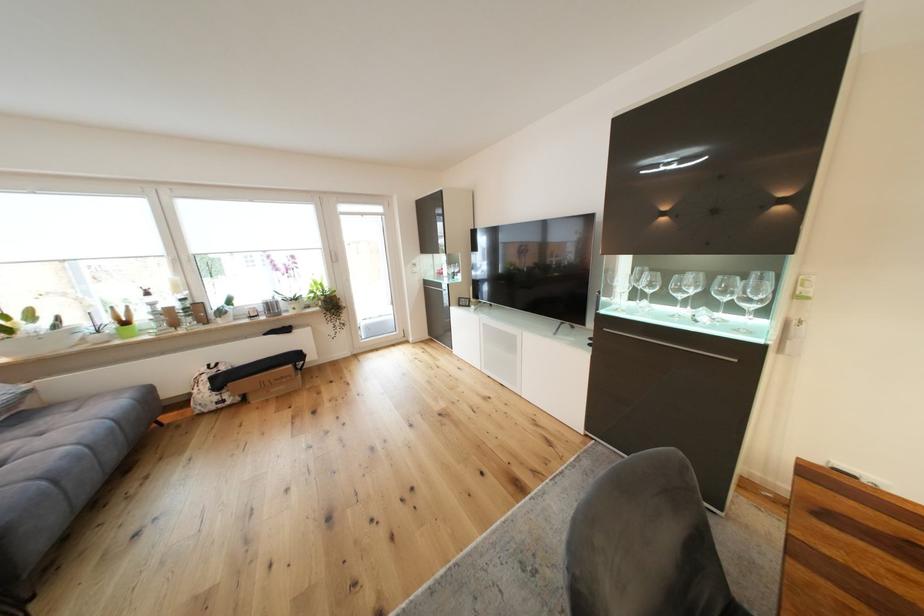
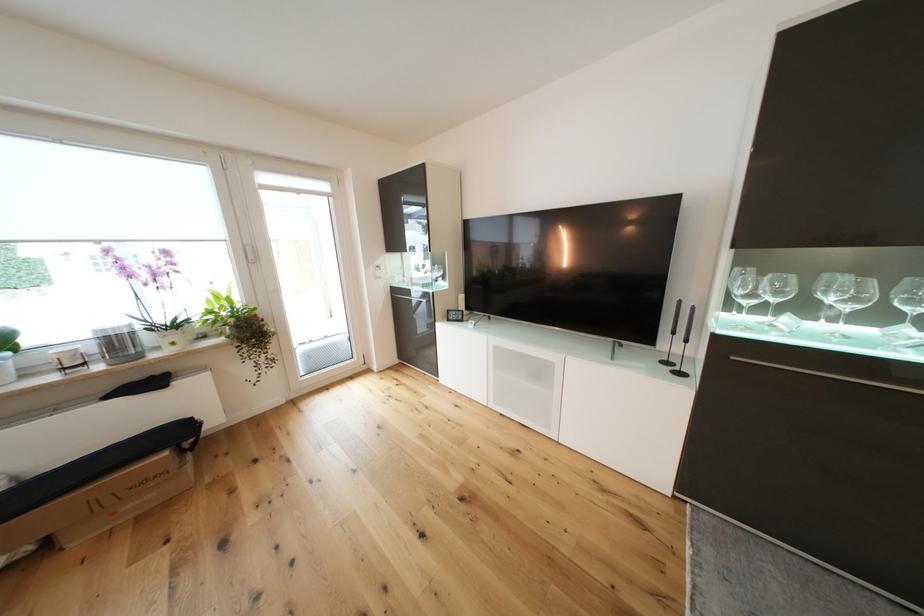
The point at (297, 368) is marked in the first image. Where is the corresponding point in the second image?

(172, 455)